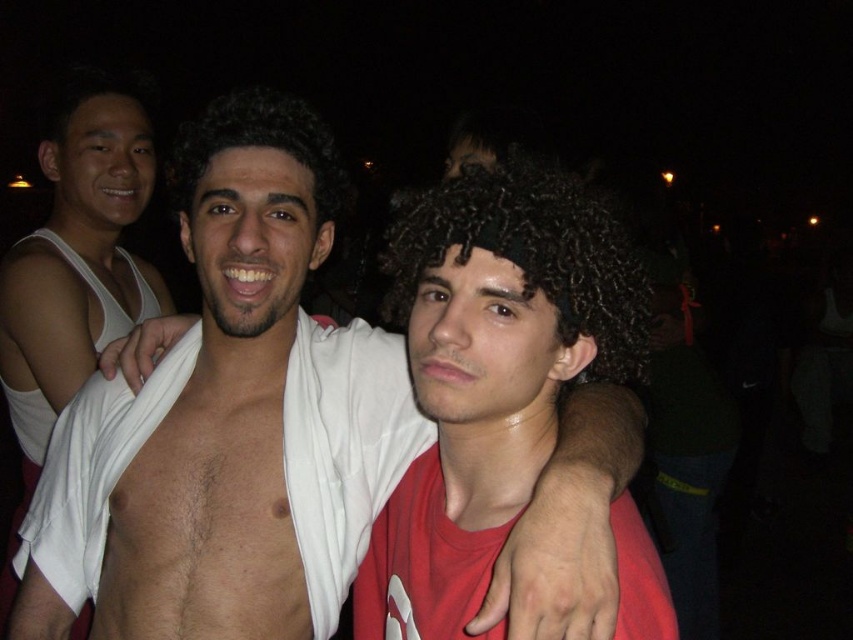
Looking at this image, can you confirm if shiny white towel at center is bigger than curly dark brown hair at center?

No, shiny white towel at center is not bigger than curly dark brown hair at center.

At what (x,y) coordinates should I click in order to perform the action: click on shiny white towel at center. Please return your answer as a coordinate pair (x, y). Looking at the image, I should click on (231, 392).

Locate an element on the screen. This screenshot has width=853, height=640. shiny white towel at center is located at coordinates (231, 392).

Is white tank top at left to the right of dark curly hair at center from the viewer's perspective?

Incorrect, white tank top at left is not on the right side of dark curly hair at center.

Between point (48, 289) and point (177, 144), which one is positioned behind?

Positioned behind is point (48, 289).

Which is in front, point (68, 381) or point (201, 112)?

Point (68, 381) is in front.

The image size is (853, 640). I want to click on white tank top at left, so click(x=74, y=264).

Which is behind, point (190, 445) or point (258, 131)?

The point (190, 445) is behind.

Measure the distance between point (268, 512) and camera.

A distance of 1.02 meters exists between point (268, 512) and camera.

Which is in front, point (538, 552) or point (260, 113)?

Positioned in front is point (538, 552).

Locate an element on the screen. shiny white towel at center is located at coordinates (231, 392).